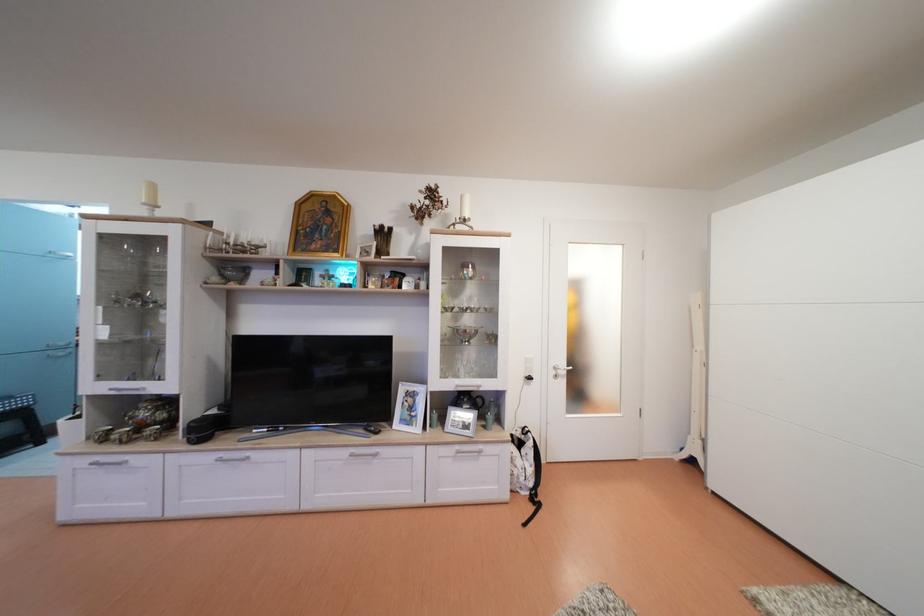
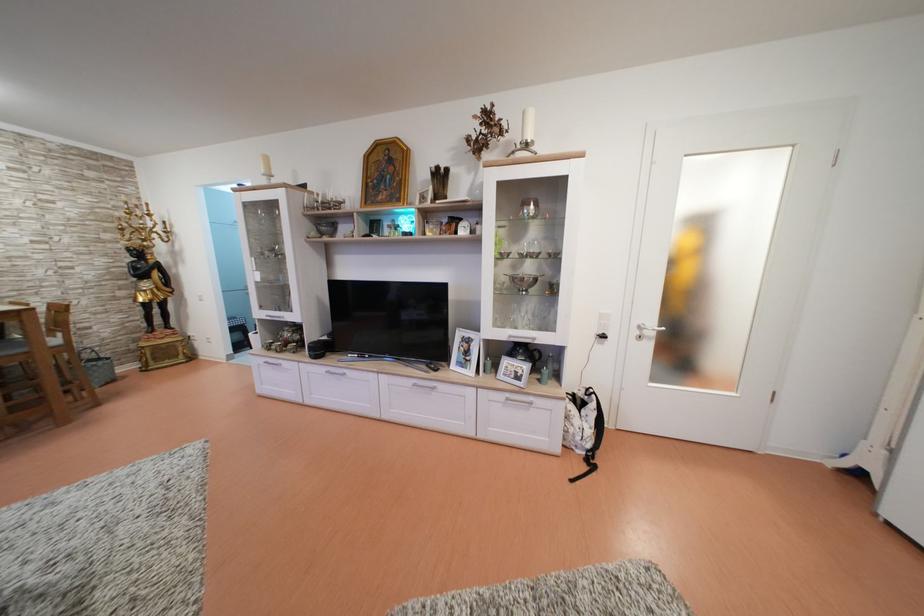
Find the pixel in the second image that matches (x=465, y=453) in the first image.

(515, 400)